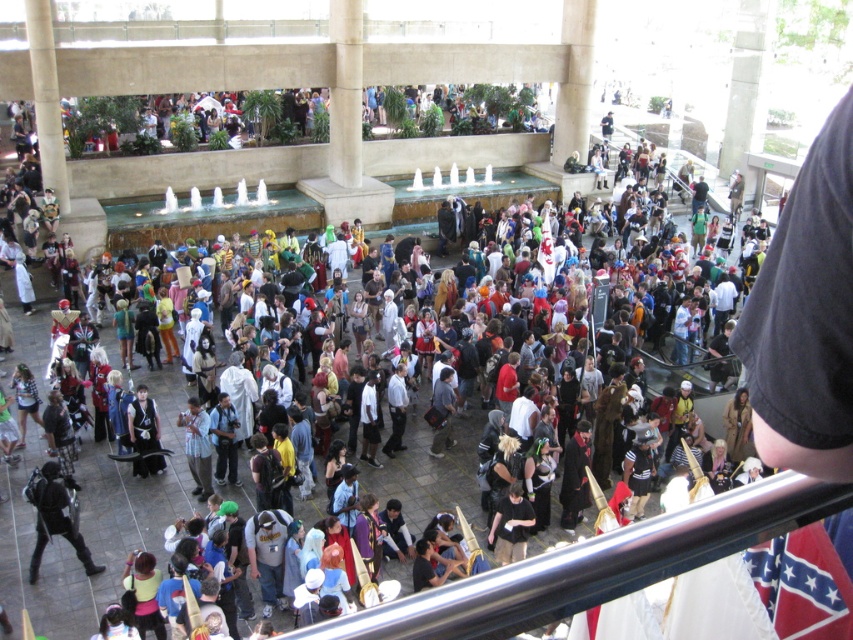
Is black matte backpack at lower left taller than black leather jacket at center?

Indeed, black matte backpack at lower left has a greater height compared to black leather jacket at center.

Which of these two, black matte backpack at lower left or black leather jacket at center, stands shorter?

With less height is black leather jacket at center.

What are the coordinates of `black matte backpack at lower left` in the screenshot? It's located at (53, 518).